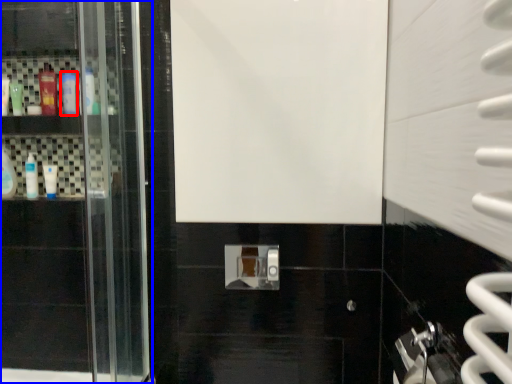
Question: Which object is further to the camera taking this photo, mouthwash (highlighted by a red box) or door (highlighted by a blue box)?

Choices:
 (A) mouthwash
 (B) door

Answer: (A)